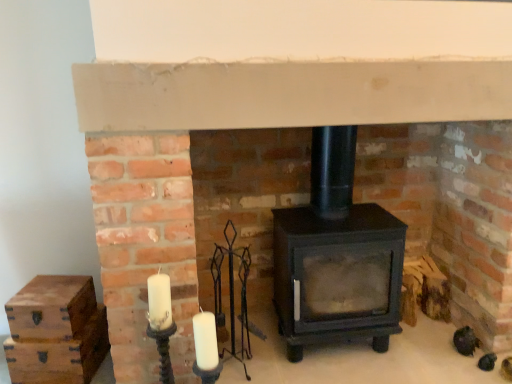
Find the location of a particular element. The image size is (512, 384). matte black wood burning stove at center is located at coordinates (336, 256).

In order to click on wooden chest at left, the second drawer when ordered from bottom to top in this screenshot , I will do `click(51, 307)`.

The height and width of the screenshot is (384, 512). Identify the location of matte black wood burning stove at center. (336, 256).

Is wooden chest at left, the second drawer when ordered from bottom to top, turned away from wooden chest at lower left, the 2th drawer from the top?

No.

Considering the relative sizes of wooden chest at left, arranged as the 1th drawer when viewed from the top, and wooden chest at lower left, the 2th drawer from the top, in the image provided, is wooden chest at left, arranged as the 1th drawer when viewed from the top, thinner than wooden chest at lower left, the 2th drawer from the top,?

No, wooden chest at left, arranged as the 1th drawer when viewed from the top, is not thinner than wooden chest at lower left, the 2th drawer from the top.

From the image's perspective, which is below, wooden chest at left, arranged as the 1th drawer when viewed from the top, or wooden chest at lower left, which appears as the first drawer when ordered from the bottom?

wooden chest at lower left, which appears as the first drawer when ordered from the bottom, appears lower in the image.

Considering their positions, is wooden chest at left, the second drawer when ordered from bottom to top, located in front of or behind wooden chest at lower left, the 2th drawer from the top?

Visually, wooden chest at left, the second drawer when ordered from bottom to top, is located in front of wooden chest at lower left, the 2th drawer from the top.

Could wooden chest at lower left, which appears as the first drawer when ordered from the bottom, be considered to be inside matte black wood burning stove at center?

Actually, wooden chest at lower left, which appears as the first drawer when ordered from the bottom, is outside matte black wood burning stove at center.

Does point (328, 334) come farther from viewer compared to point (22, 347)?

Yes, it is behind point (22, 347).

Which of these two, matte black wood burning stove at center or wooden chest at lower left, the 2th drawer from the top, is thinner?

With smaller width is wooden chest at lower left, the 2th drawer from the top.

I want to click on drawer that is the 2nd object to the left of the matte black wood burning stove at center, starting at the anchor, so click(x=60, y=355).

Is wooden chest at lower left, the 2th drawer from the top, closer to the viewer compared to matte black wood burning stove at center?

No, wooden chest at lower left, the 2th drawer from the top, is behind matte black wood burning stove at center.

This screenshot has height=384, width=512. Find the location of `wood burning stove above the wooden chest at lower left, which appears as the first drawer when ordered from the bottom (from the image's perspective)`. wood burning stove above the wooden chest at lower left, which appears as the first drawer when ordered from the bottom (from the image's perspective) is located at coordinates (336, 256).

Does point (97, 330) come farther from viewer compared to point (317, 137)?

No.

From the image's perspective, is matte black wood burning stove at center positioned above or below wooden chest at left, arranged as the 1th drawer when viewed from the top?

Clearly, from the image's perspective, matte black wood burning stove at center is above wooden chest at left, arranged as the 1th drawer when viewed from the top.

Looking at the image, does matte black wood burning stove at center seem bigger or smaller compared to wooden chest at left, the second drawer when ordered from bottom to top?

Considering their sizes, matte black wood burning stove at center takes up more space than wooden chest at left, the second drawer when ordered from bottom to top.

Would you say matte black wood burning stove at center is a long distance from wooden chest at left, arranged as the 1th drawer when viewed from the top?

Yes, matte black wood burning stove at center and wooden chest at left, arranged as the 1th drawer when viewed from the top, are located far from each other.

From a real-world perspective, is matte black wood burning stove at center physically located above or below wooden chest at left, arranged as the 1th drawer when viewed from the top?

matte black wood burning stove at center is above wooden chest at left, arranged as the 1th drawer when viewed from the top.

Consider the image. Does wooden chest at left, arranged as the 1th drawer when viewed from the top, turn towards matte black wood burning stove at center?

No, wooden chest at left, arranged as the 1th drawer when viewed from the top, is not turned towards matte black wood burning stove at center.

Is wooden chest at left, arranged as the 1th drawer when viewed from the top, wider than matte black wood burning stove at center?

No, wooden chest at left, arranged as the 1th drawer when viewed from the top, is not wider than matte black wood burning stove at center.

Which is in front, wooden chest at left, arranged as the 1th drawer when viewed from the top, or matte black wood burning stove at center?

Positioned in front is matte black wood burning stove at center.

Is wooden chest at left, arranged as the 1th drawer when viewed from the top, next to matte black wood burning stove at center?

No.

Looking at this image, could you tell me if wooden chest at lower left, the 2th drawer from the top, is turned towards wooden chest at left, the second drawer when ordered from bottom to top?

No, wooden chest at lower left, the 2th drawer from the top, does not turn towards wooden chest at left, the second drawer when ordered from bottom to top.

Locate an element on the screen. drawer above the wooden chest at lower left, which appears as the first drawer when ordered from the bottom (from a real-world perspective) is located at coordinates (51, 307).

From the picture: How much distance is there between wooden chest at lower left, the 2th drawer from the top, and wooden chest at left, arranged as the 1th drawer when viewed from the top?

wooden chest at lower left, the 2th drawer from the top, and wooden chest at left, arranged as the 1th drawer when viewed from the top, are 4.72 inches apart from each other.

In the scene shown: Can you confirm if wooden chest at lower left, which appears as the first drawer when ordered from the bottom, is positioned to the left of wooden chest at left, the second drawer when ordered from bottom to top?

Indeed, wooden chest at lower left, which appears as the first drawer when ordered from the bottom, is positioned on the left side of wooden chest at left, the second drawer when ordered from bottom to top.

At what (x,y) coordinates should I click in order to perform the action: click on drawer lying below the wooden chest at left, the second drawer when ordered from bottom to top (from the image's perspective). Please return your answer as a coordinate pair (x, y). Image resolution: width=512 pixels, height=384 pixels. Looking at the image, I should click on (60, 355).

The width and height of the screenshot is (512, 384). I want to click on the 2nd drawer located beneath the matte black wood burning stove at center (from a real-world perspective), so click(60, 355).

Estimate the real-world distances between objects in this image. Which object is further from wooden chest at lower left, the 2th drawer from the top, wooden chest at left, the second drawer when ordered from bottom to top, or matte black wood burning stove at center?

The object further to wooden chest at lower left, the 2th drawer from the top, is matte black wood burning stove at center.

From the image, which object appears to be nearer to matte black wood burning stove at center, wooden chest at lower left, which appears as the first drawer when ordered from the bottom, or wooden chest at left, the second drawer when ordered from bottom to top?

The object closer to matte black wood burning stove at center is wooden chest at lower left, which appears as the first drawer when ordered from the bottom.

From the image, which object appears to be nearer to wooden chest at left, arranged as the 1th drawer when viewed from the top, wooden chest at lower left, the 2th drawer from the top, or matte black wood burning stove at center?

wooden chest at lower left, the 2th drawer from the top, lies closer to wooden chest at left, arranged as the 1th drawer when viewed from the top, than the other object.

Based on their spatial positions, is matte black wood burning stove at center or wooden chest at lower left, the 2th drawer from the top, closer to wooden chest at left, arranged as the 1th drawer when viewed from the top?

wooden chest at lower left, the 2th drawer from the top, is positioned closer to the anchor wooden chest at left, arranged as the 1th drawer when viewed from the top.

From the image, which object appears to be farther from wooden chest at lower left, which appears as the first drawer when ordered from the bottom, matte black wood burning stove at center or wooden chest at left, arranged as the 1th drawer when viewed from the top?

matte black wood burning stove at center lies further to wooden chest at lower left, which appears as the first drawer when ordered from the bottom, than the other object.

From the image, which object appears to be farther from matte black wood burning stove at center, wooden chest at left, arranged as the 1th drawer when viewed from the top, or wooden chest at lower left, the 2th drawer from the top?

Based on the image, wooden chest at left, arranged as the 1th drawer when viewed from the top, appears to be further to matte black wood burning stove at center.

At what (x,y) coordinates should I click in order to perform the action: click on drawer situated between wooden chest at lower left, which appears as the first drawer when ordered from the bottom, and matte black wood burning stove at center from left to right. Please return your answer as a coordinate pair (x, y). Looking at the image, I should click on (51, 307).